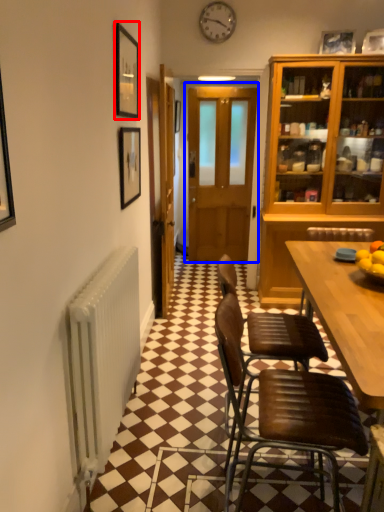
Question: Which object appears farthest to the camera in this image, picture frame (highlighted by a red box) or door (highlighted by a blue box)?

Choices:
 (A) picture frame
 (B) door

Answer: (B)